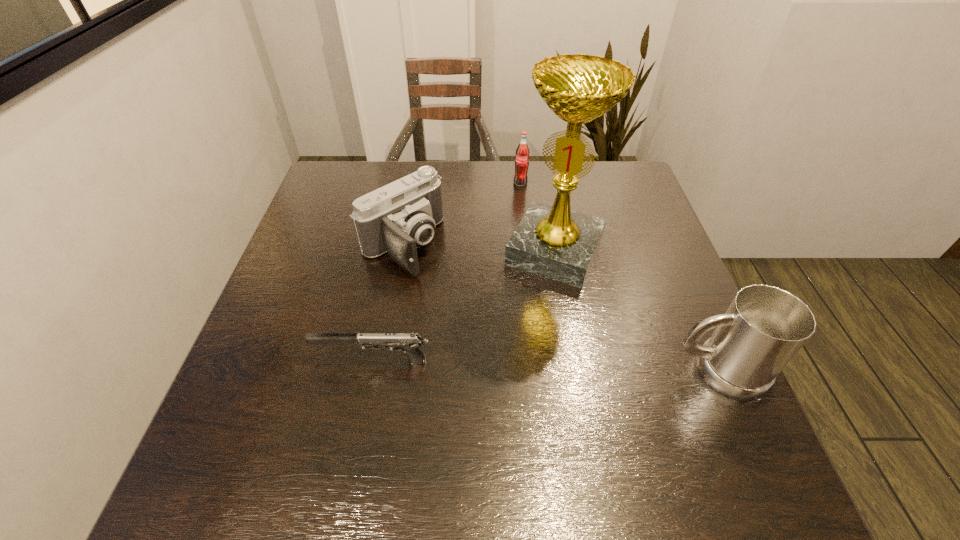
Where is `vacant point located between the mug and the tallest object`? vacant point located between the mug and the tallest object is located at coordinates (636, 311).

Where is `free space between the camera and the farthest object`? This screenshot has width=960, height=540. free space between the camera and the farthest object is located at coordinates (462, 214).

The image size is (960, 540). Find the location of `vacant point located between the award and the gun`. vacant point located between the award and the gun is located at coordinates (464, 306).

You are a GUI agent. You are given a task and a screenshot of the screen. Output one action in this format:
    pyautogui.click(x=<x>, y=<y>)
    Task: Click on the vacant space that's between the rightmost object and the farthest object
    The height and width of the screenshot is (540, 960).
    Given the screenshot: What is the action you would take?
    pyautogui.click(x=618, y=277)

Find the location of `free area in between the camera and the mug`. free area in between the camera and the mug is located at coordinates (560, 308).

Locate an element on the screen. This screenshot has height=540, width=960. free space between the farthest object and the shortest object is located at coordinates (447, 272).

Locate an element on the screen. This screenshot has height=540, width=960. blank region between the gun and the soda bottle is located at coordinates (447, 272).

Locate an element on the screen. unoccupied position between the gun and the farthest object is located at coordinates (447, 272).

Locate an element on the screen. The height and width of the screenshot is (540, 960). vacant area that lies between the mug and the soda bottle is located at coordinates (618, 277).

Identify the location of free spot between the shortest object and the camera. The image size is (960, 540). (388, 303).